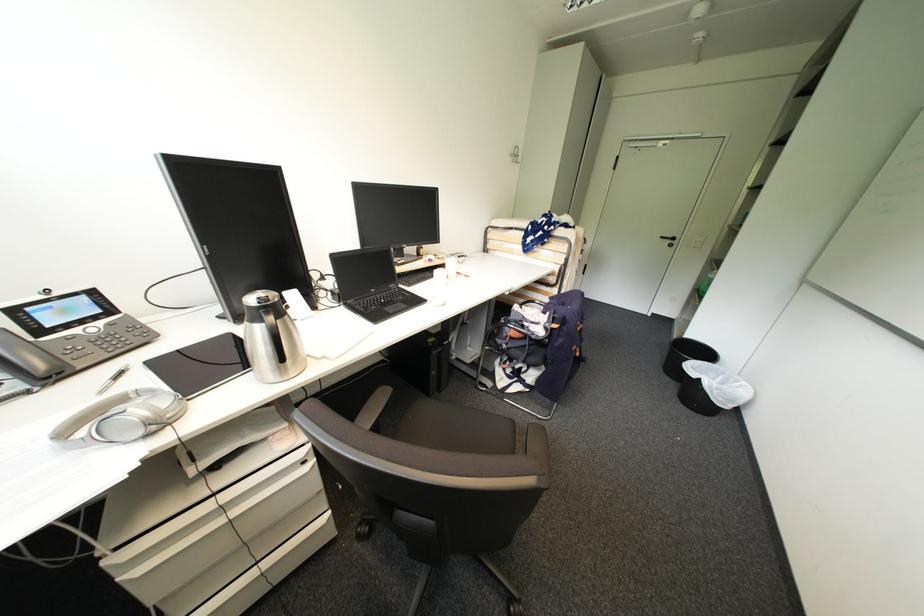
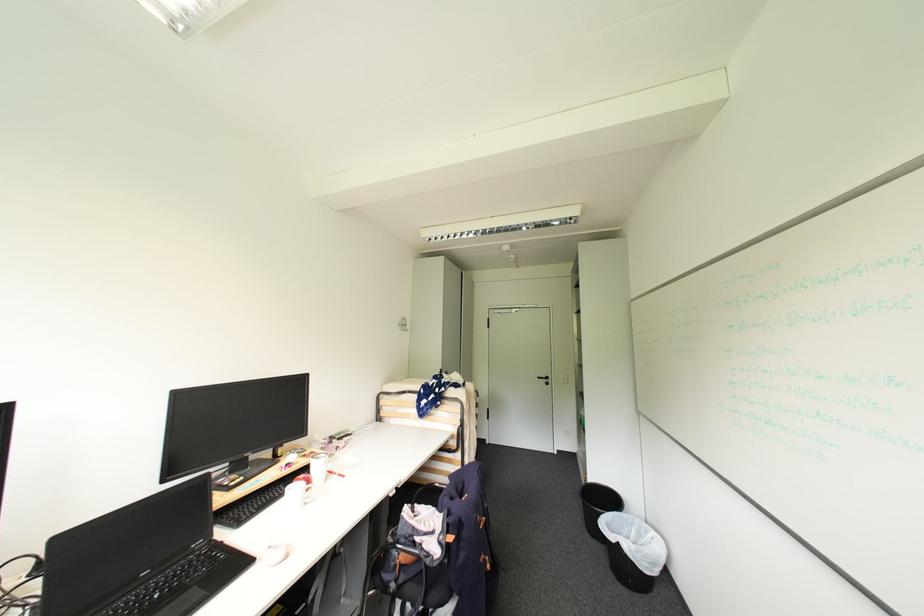
In the second image, find the point that corresponds to [669,238] in the first image.

(544, 379)